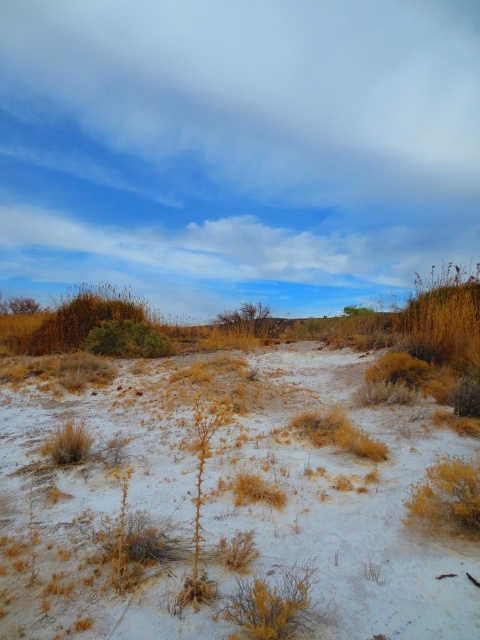
You are standing at the camera position looking at the landscape. There are two points marked in the scene, point A at coordinates point (215, 493) and point B at coordinates point (210, 433). Which point is closer to you?

Point point (215, 493) is closer to the camera than point point (210, 433).

You are a hiker trying to determine the best path to avoid getting your shoes dirty. You notice the white sandy soil at center and the dry grass at center. Which surface is more likely to be loose and sandy, making it easier to walk on without disturbing the environment?

The white sandy soil at center is larger in size than dry grass at center, so it is more likely to be loose and sandy, making it easier to walk on without disturbing the environment.

You are a hiker trying to navigate through the desert. You see the white sandy soil at center and the dry grass at center. Which one is located to the left?

The white sandy soil at center is positioned on the left side of dry grass at center, so the white sandy soil at center is located to the left.